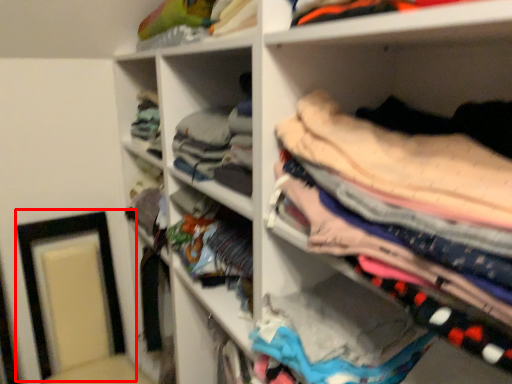
Question: Observing the image, what is the correct spatial positioning of picture frame (annotated by the red box) in reference to clothing?

Choices:
 (A) right
 (B) left

Answer: (B)